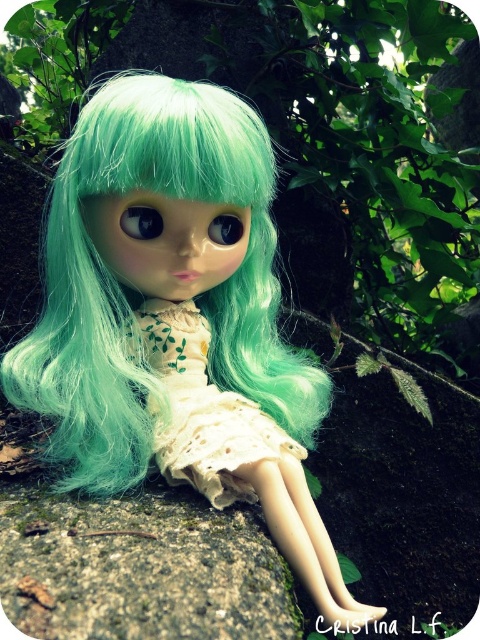
Question: Does matte green wig at center appear on the right side of white lace dress at center?

Choices:
 (A) yes
 (B) no

Answer: (B)

Question: Which point is farther to the camera?

Choices:
 (A) matte green wig at center
 (B) green leafy tree at center

Answer: (B)

Question: Which is nearer to the white lace dress at center?

Choices:
 (A) matte green wig at center
 (B) green leafy tree at center

Answer: (A)

Question: Does matte green wig at center have a larger size compared to green leafy tree at center?

Choices:
 (A) no
 (B) yes

Answer: (A)

Question: Considering the real-world distances, which object is farthest from the matte green wig at center?

Choices:
 (A) green leafy tree at center
 (B) white lace dress at center

Answer: (A)

Question: Does matte green wig at center appear on the left side of green leafy tree at center?

Choices:
 (A) yes
 (B) no

Answer: (A)